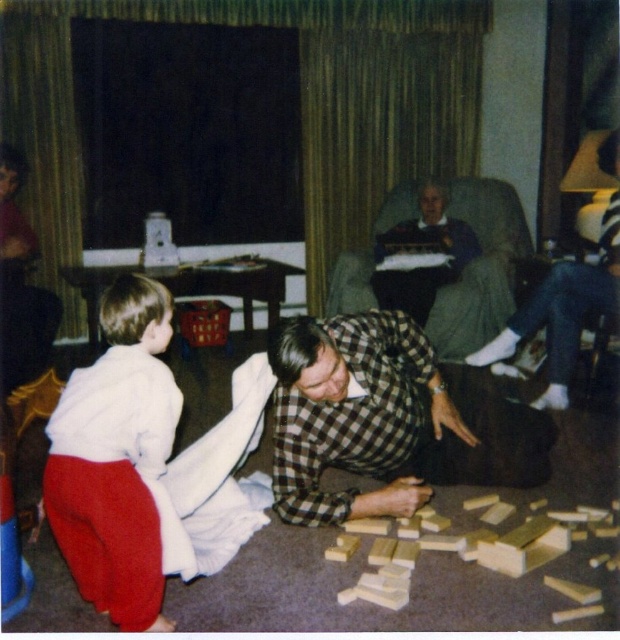
Question: Which object is closer to the camera taking this photo?

Choices:
 (A) white cotton shirt at lower left
 (B) gray fabric armchair at center

Answer: (A)

Question: Which of the following is the farthest from the observer?

Choices:
 (A) (394, 444)
 (B) (343, 259)

Answer: (B)

Question: Is checkered fabric shirt at center above white cotton shirt at lower left?

Choices:
 (A) yes
 (B) no

Answer: (B)

Question: Which point is farther from the camera taking this photo?

Choices:
 (A) (520, 420)
 (B) (138, 465)
 (C) (330, 308)

Answer: (C)

Question: Is white cotton shirt at lower left to the left of gray fabric armchair at center from the viewer's perspective?

Choices:
 (A) no
 (B) yes

Answer: (B)

Question: Does checkered fabric shirt at center have a greater width compared to gray fabric armchair at center?

Choices:
 (A) no
 (B) yes

Answer: (B)